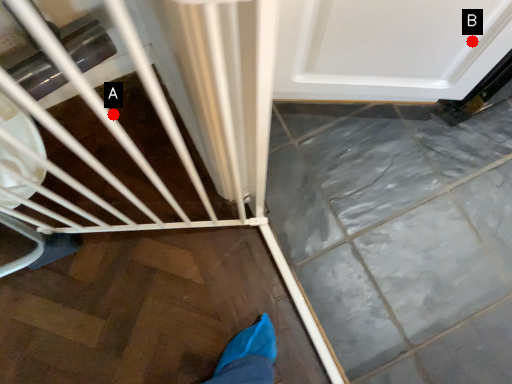
Question: Two points are circled on the image, labeled by A and B beside each circle. Which of the following is the closest to the observer?

Choices:
 (A) A is closer
 (B) B is closer

Answer: (B)